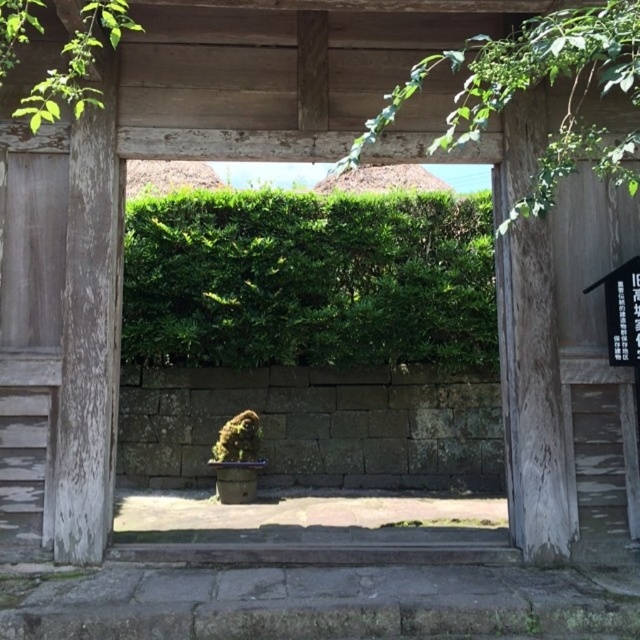
You are standing outside the rustic wooden gate and want to see the entire garden. Which hedge, the green leafy hedge at center or the green leafy hedge at upper center, would you need to look up higher to view?

The green leafy hedge at center has a greater height compared to the green leafy hedge at upper center, so you would need to look up higher to view the green leafy hedge at center.

You are standing at the entrance of the rustic wooden gate and want to know the position of the green leafy hedge at center. Can you determine if it is positioned to the left or right side of the gate?

The green leafy hedge at center is located at point coordinates, but without specific reference points or directional markers in the scene description, it is not possible to determine if it is positioned to the left or right of the gate based solely on the provided information.